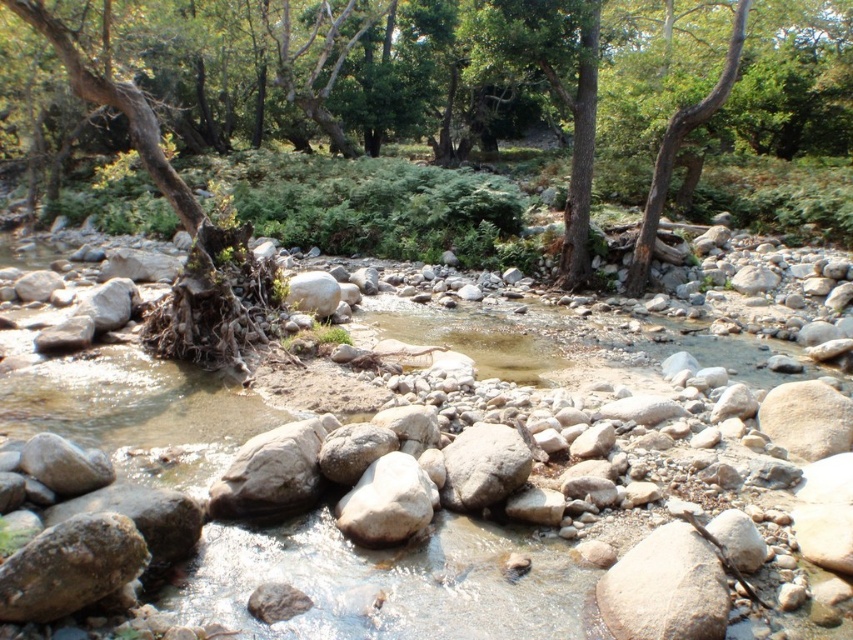
You are standing at the point with coordinates point (387,474) and want to reach the point with coordinates point (189,285). Which direction should you move in relative to the stream to get there?

Since point (189,285) is behind point (387,474), you should move in the direction opposite to the stream flow to reach it.